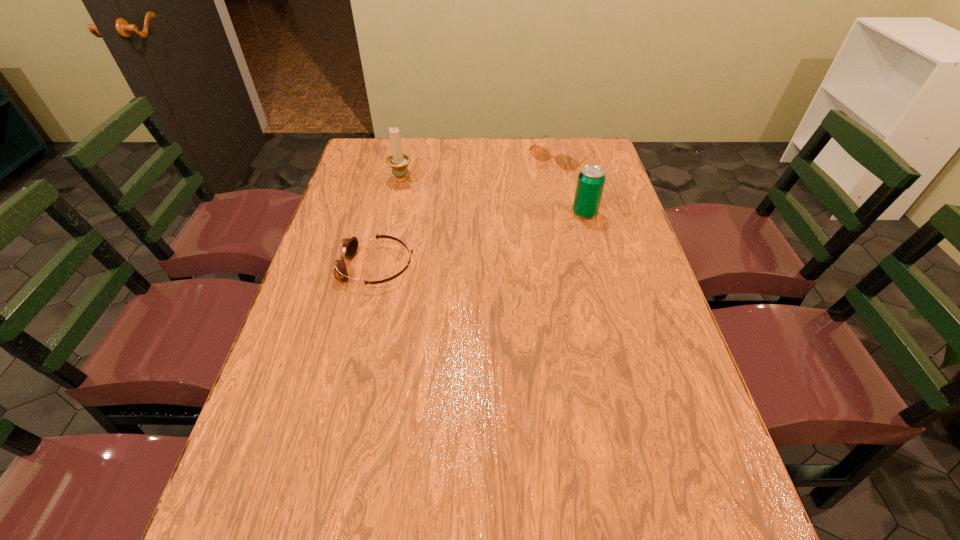
Identify the location of object that is at the far right corner. This screenshot has width=960, height=540. (566, 162).

In the image, there is a desktop. What are the coordinates of `blank space at the far edge` in the screenshot? It's located at (553, 138).

The image size is (960, 540). Identify the location of free space at the left edge of the desktop. (374, 231).

The height and width of the screenshot is (540, 960). I want to click on free space at the right edge of the desktop, so click(605, 271).

At what (x,y) coordinates should I click in order to perform the action: click on vacant space at the far left corner. Please return your answer as a coordinate pair (x, y). The height and width of the screenshot is (540, 960). Looking at the image, I should click on pyautogui.click(x=367, y=156).

Identify the location of vacant space at the near left corner of the desktop. click(x=312, y=490).

Where is `vacant space at the far right corner of the desktop`? vacant space at the far right corner of the desktop is located at coordinates (581, 156).

This screenshot has height=540, width=960. I want to click on vacant area that lies between the beer can and the goggles, so click(x=481, y=240).

The image size is (960, 540). Find the location of `vacant area between the second tallest object and the candle_holder`. vacant area between the second tallest object and the candle_holder is located at coordinates (492, 197).

The height and width of the screenshot is (540, 960). I want to click on vacant space that is in between the goggles and the tallest object, so click(x=389, y=223).